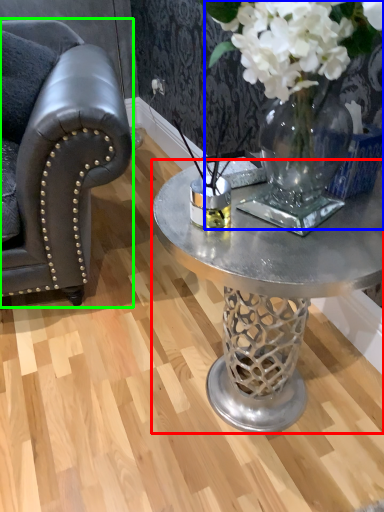
Question: Based on their relative distances, which object is nearer to coffee table (highlighted by a red box)? Choose from floral arrangement (highlighted by a blue box) and chair (highlighted by a green box).

Choices:
 (A) floral arrangement
 (B) chair

Answer: (A)